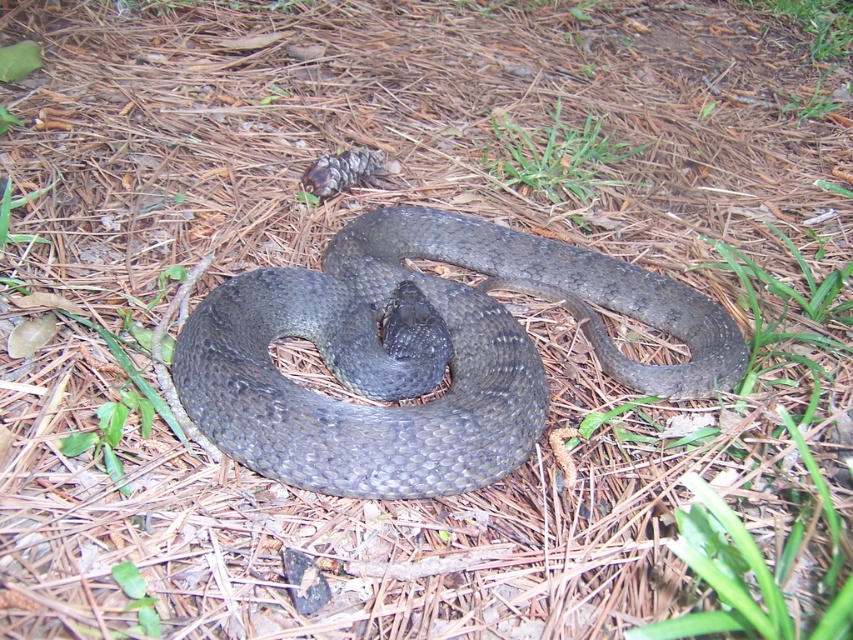
Which of these two, shiny dark gray snake at center or green soft grass at upper center, stands shorter?

With less height is green soft grass at upper center.

Which of these two, shiny dark gray snake at center or green soft grass at upper center, stands taller?

shiny dark gray snake at center is taller.

Is point (244, 371) positioned after point (610, 154)?

That is False.

Find the location of a particular element. The width and height of the screenshot is (853, 640). shiny dark gray snake at center is located at coordinates (419, 355).